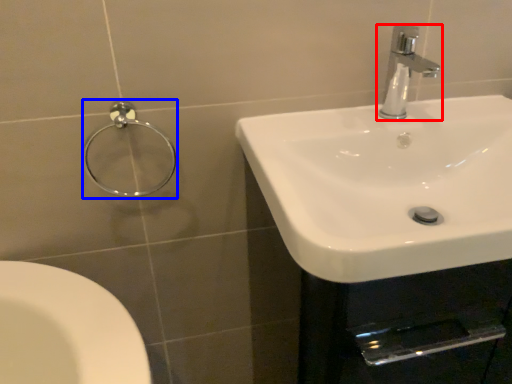
Question: Which of the following is the closest to the observer, tap (highlighted by a red box) or shower (highlighted by a blue box)?

Choices:
 (A) tap
 (B) shower

Answer: (A)